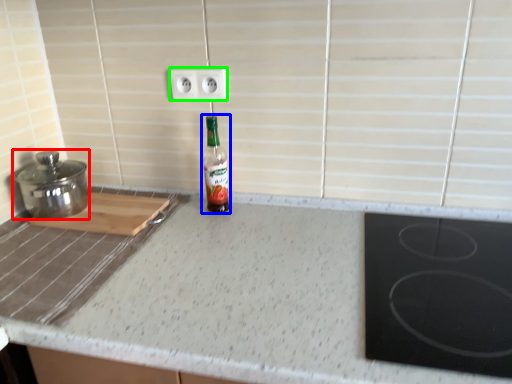
Question: Which is nearer to the kitchen appliance (highlighted by a red box)? bottle (highlighted by a blue box) or electric outlet (highlighted by a green box).

Choices:
 (A) bottle
 (B) electric outlet

Answer: (A)